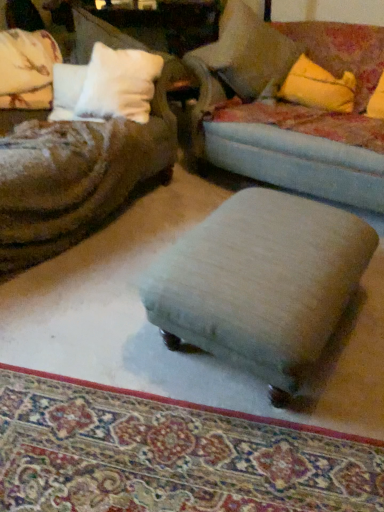
Question: Is yellow fabric pillow at upper right to the right of light beige fabric stool at center from the viewer's perspective?

Choices:
 (A) yes
 (B) no

Answer: (A)

Question: From the image's perspective, is yellow fabric pillow at upper right under light beige fabric stool at center?

Choices:
 (A) yes
 (B) no

Answer: (B)

Question: Is yellow fabric pillow at upper right located outside light beige fabric stool at center?

Choices:
 (A) no
 (B) yes

Answer: (B)

Question: From a real-world perspective, is yellow fabric pillow at upper right located beneath light beige fabric stool at center?

Choices:
 (A) no
 (B) yes

Answer: (A)

Question: Does yellow fabric pillow at upper right have a greater width compared to light beige fabric stool at center?

Choices:
 (A) yes
 (B) no

Answer: (B)

Question: Is white soft pillow at upper left, which appears as the 1th pillow when viewed from the left, bigger or smaller than velvet blue studio couch at center?

Choices:
 (A) small
 (B) big

Answer: (A)

Question: Is white soft pillow at upper left, which is the 2th pillow from right to left, to the left or to the right of velvet blue studio couch at center in the image?

Choices:
 (A) left
 (B) right

Answer: (A)

Question: Relative to velvet blue studio couch at center, is white soft pillow at upper left, which is the 2th pillow from right to left, in front or behind?

Choices:
 (A) behind
 (B) front

Answer: (A)

Question: Would you say white soft pillow at upper left, which appears as the 1th pillow when viewed from the left, is inside or outside velvet blue studio couch at center?

Choices:
 (A) inside
 (B) outside

Answer: (B)

Question: Is yellow fabric pillow at upper right in front of or behind beige fabric ottoman at center in the image?

Choices:
 (A) behind
 (B) front

Answer: (A)

Question: Is yellow fabric pillow at upper right inside the boundaries of beige fabric ottoman at center, or outside?

Choices:
 (A) outside
 (B) inside

Answer: (A)

Question: Is yellow fabric pillow at upper right taller or shorter than beige fabric ottoman at center?

Choices:
 (A) tall
 (B) short

Answer: (A)

Question: Does point (284, 91) appear closer or farther from the camera than point (148, 443)?

Choices:
 (A) farther
 (B) closer

Answer: (A)

Question: From a real-world perspective, is velvet blue studio couch at center above or below soft beige pillow at upper right, the second pillow in the left-to-right sequence?

Choices:
 (A) below
 (B) above

Answer: (A)

Question: Is point (279, 76) positioned closer to the camera than point (246, 49)?

Choices:
 (A) farther
 (B) closer

Answer: (A)